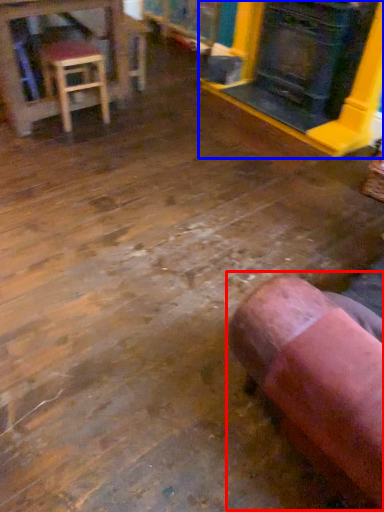
Question: Which point is closer to the camera, bean bag chair (highlighted by a red box) or fireplace (highlighted by a blue box)?

Choices:
 (A) bean bag chair
 (B) fireplace

Answer: (A)